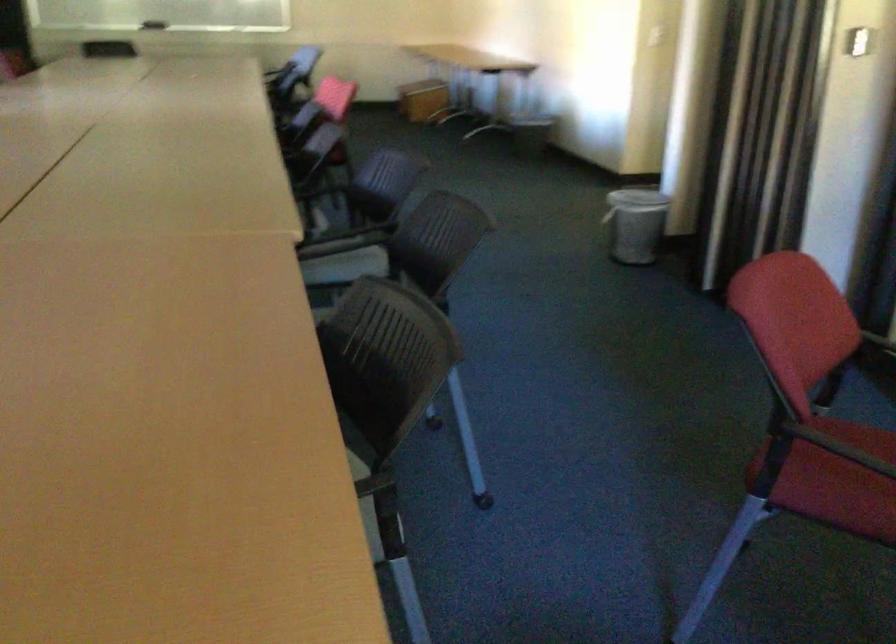
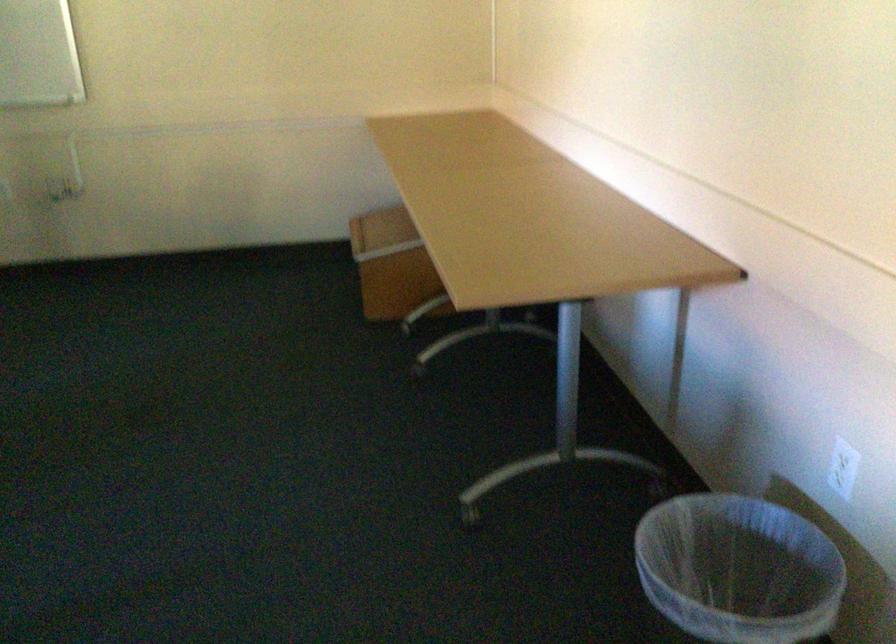
The point at (570, 124) is marked in the first image. Where is the corresponding point in the second image?

(737, 569)